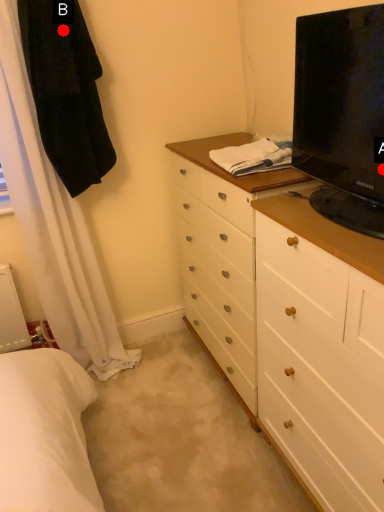
Question: Two points are circled on the image, labeled by A and B beside each circle. Which point appears farthest from the camera in this image?

Choices:
 (A) A is further
 (B) B is further

Answer: (B)